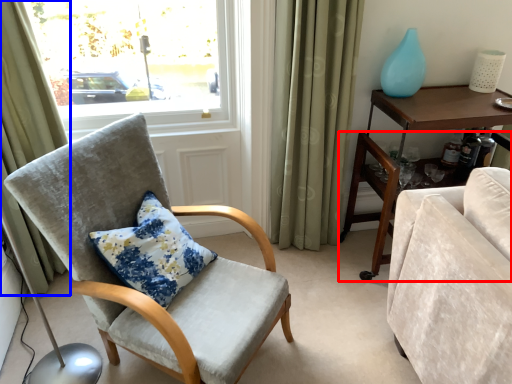
Question: Which object is closer to the camera taking this photo, desk (highlighted by a red box) or curtain (highlighted by a blue box)?

Choices:
 (A) desk
 (B) curtain

Answer: (B)